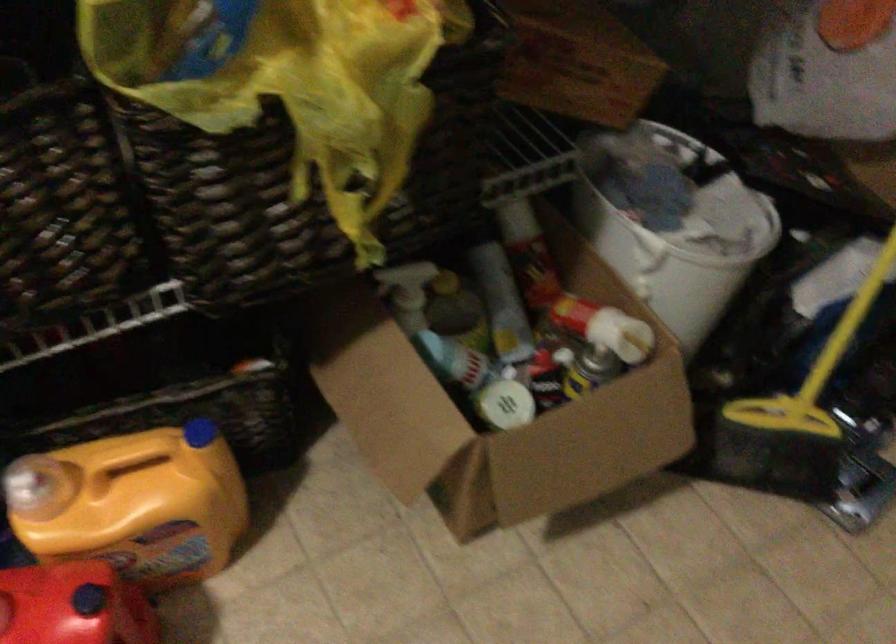
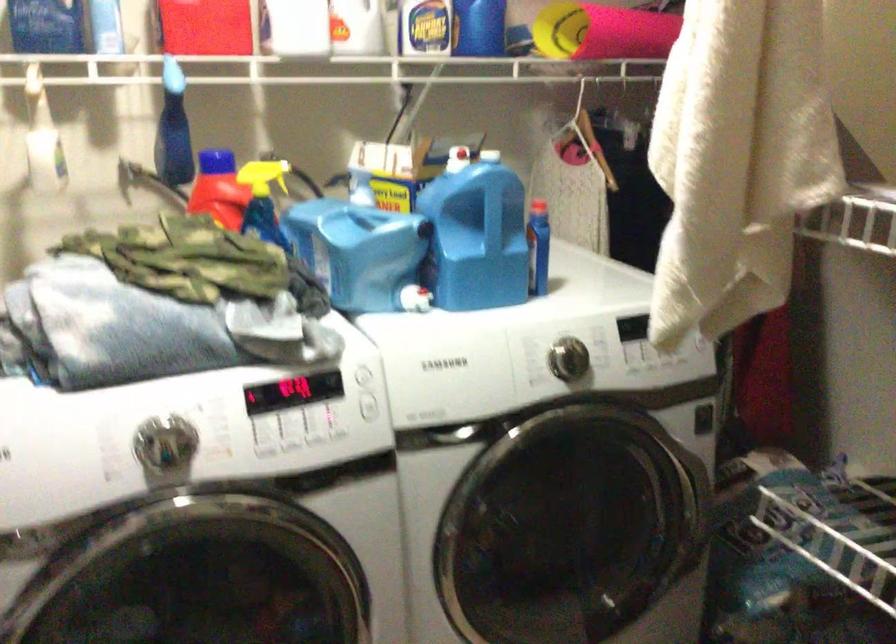
Question: The images are taken continuously from a first-person perspective. In which direction is your viewpoint rotating?

Choices:
 (A) Left
 (B) Right
 (C) Up
 (D) Down

Answer: (A)